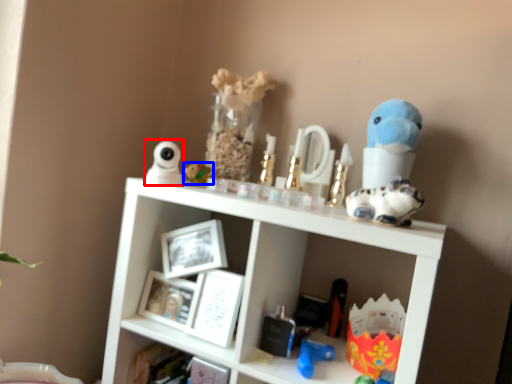
Question: Which of the following is the farthest to the observer, toy (highlighted by a red box) or toy (highlighted by a blue box)?

Choices:
 (A) toy
 (B) toy

Answer: (B)